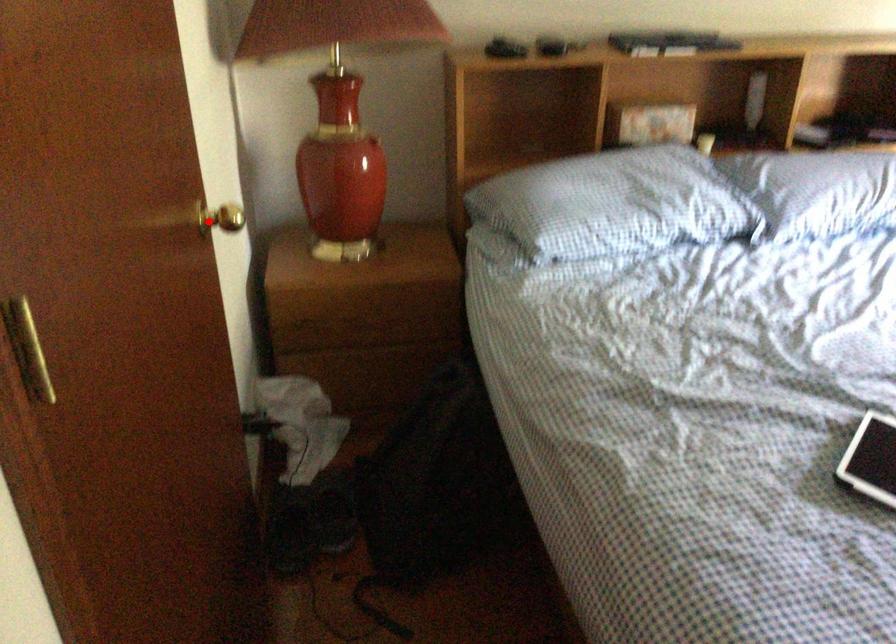
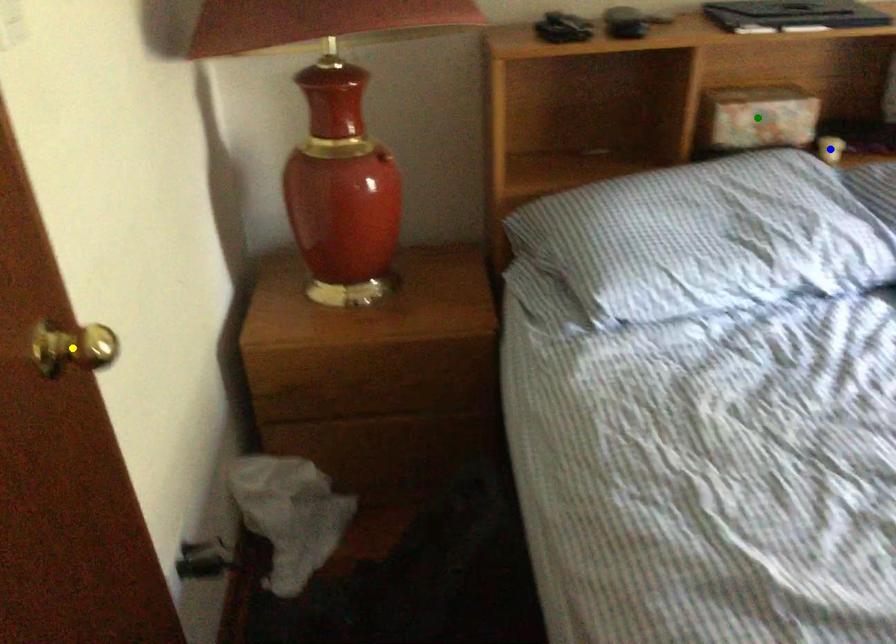
Question: I am providing you with two images of the same scene from different viewpoints. A red point is marked on the first image. You are given multiple points on the second image. Which mark in image 2 goes with the point in image 1?

Choices:
 (A) blue point
 (B) yellow point
 (C) green point

Answer: (B)